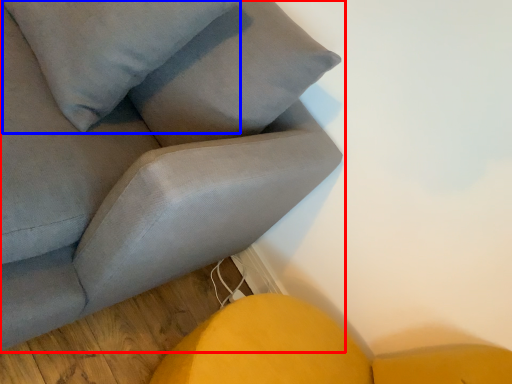
Question: Which object is closer to the camera taking this photo, studio couch (highlighted by a red box) or pillow (highlighted by a blue box)?

Choices:
 (A) studio couch
 (B) pillow

Answer: (A)